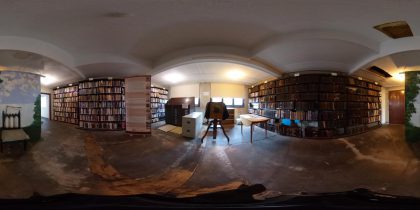
Where is `the left table legs`? This screenshot has height=210, width=420. the left table legs is located at coordinates (251, 136), (240, 129).